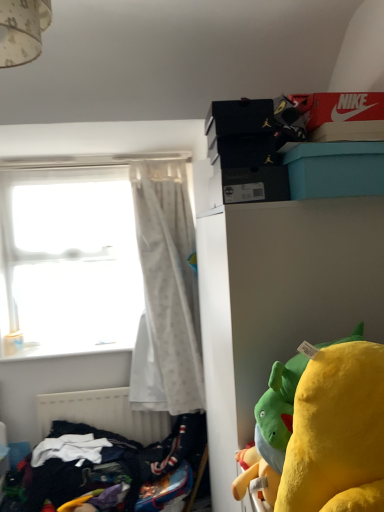
Question: Is teal plastic box at upper right bigger than transparent glass window at left?

Choices:
 (A) yes
 (B) no

Answer: (B)

Question: Is teal plastic box at upper right to the left of transparent glass window at left from the viewer's perspective?

Choices:
 (A) yes
 (B) no

Answer: (B)

Question: From a real-world perspective, is teal plastic box at upper right under transparent glass window at left?

Choices:
 (A) yes
 (B) no

Answer: (B)

Question: Does teal plastic box at upper right have a lesser height compared to transparent glass window at left?

Choices:
 (A) yes
 (B) no

Answer: (A)

Question: Is teal plastic box at upper right wider than transparent glass window at left?

Choices:
 (A) no
 (B) yes

Answer: (B)

Question: From a real-world perspective, is white matte cabinet at upper right above or below transparent glass window at left?

Choices:
 (A) below
 (B) above

Answer: (A)

Question: From their relative heights in the image, would you say white matte cabinet at upper right is taller or shorter than transparent glass window at left?

Choices:
 (A) tall
 (B) short

Answer: (A)

Question: Is white matte cabinet at upper right situated inside transparent glass window at left or outside?

Choices:
 (A) outside
 (B) inside

Answer: (A)

Question: Is point click(x=377, y=200) positioned closer to the camera than point click(x=24, y=168)?

Choices:
 (A) closer
 (B) farther

Answer: (A)

Question: From the image's perspective, is transparent glass window at left above or below white matte radiator at lower left?

Choices:
 (A) above
 (B) below

Answer: (A)

Question: In terms of size, does transparent glass window at left appear bigger or smaller than white matte radiator at lower left?

Choices:
 (A) small
 (B) big

Answer: (B)

Question: From their relative heights in the image, would you say transparent glass window at left is taller or shorter than white matte radiator at lower left?

Choices:
 (A) tall
 (B) short

Answer: (A)

Question: In terms of width, does transparent glass window at left look wider or thinner when compared to white matte radiator at lower left?

Choices:
 (A) wide
 (B) thin

Answer: (A)

Question: From a real-world perspective, relative to white sheer curtain at left, is transparent glass window at left vertically above or below?

Choices:
 (A) below
 (B) above

Answer: (B)

Question: Is transparent glass window at left in front of or behind white sheer curtain at left in the image?

Choices:
 (A) front
 (B) behind

Answer: (B)